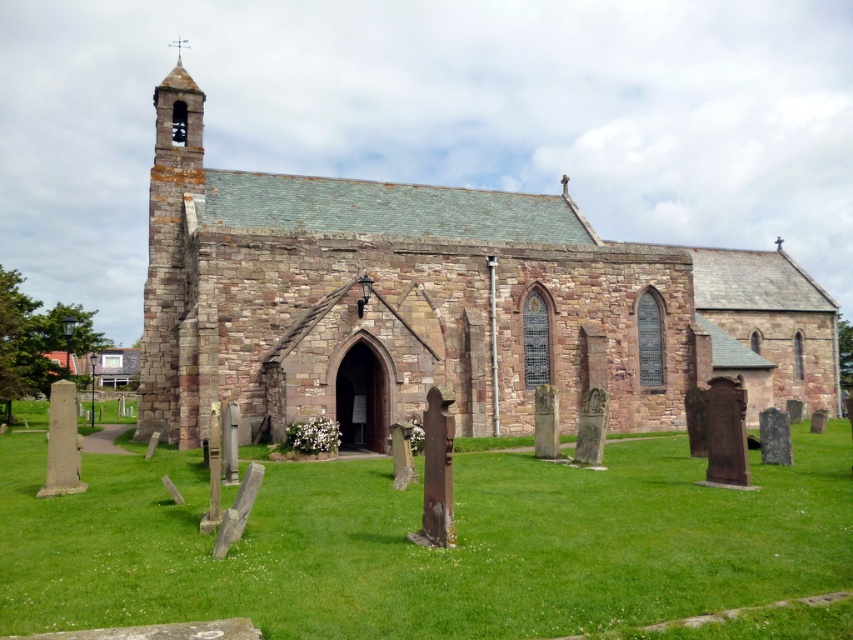
You are a landscape architect planning to install a new garden pathway between the brown stone church at center and the green grass at center. The pathway requires a minimum of 70 feet of space. Can the available distance accommodate the pathway?

The distance between the brown stone church at center and the green grass at center is 73.13 feet, which exceeds the required 70 feet. Therefore, the pathway can be accommodated in the available space.

You are standing in front of the historic stone church and want to place a small flowerpot on the ground. The flowerpot needs to be placed on a surface that is below the brown stone church at center. Can you place the flowerpot on the green grass at center?

The brown stone church at center is above the green grass at center, so yes, you can place the flowerpot on the green grass at center since it is below the church.

You are a visitor standing in front of the brown stone church at center and the green grass at center. Which object takes up more space in the image?

The brown stone church at center is bigger than the green grass at center, so it takes up more space in the image.